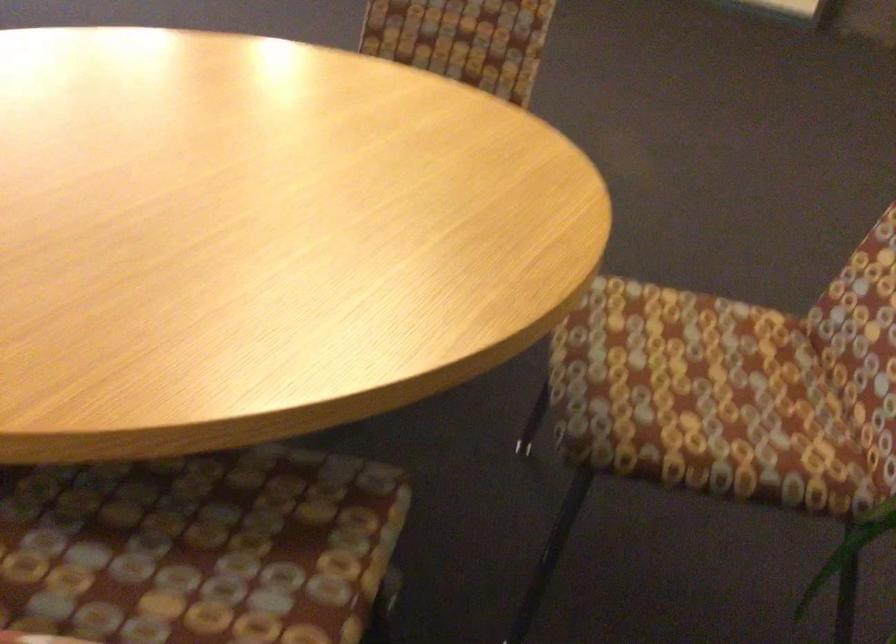
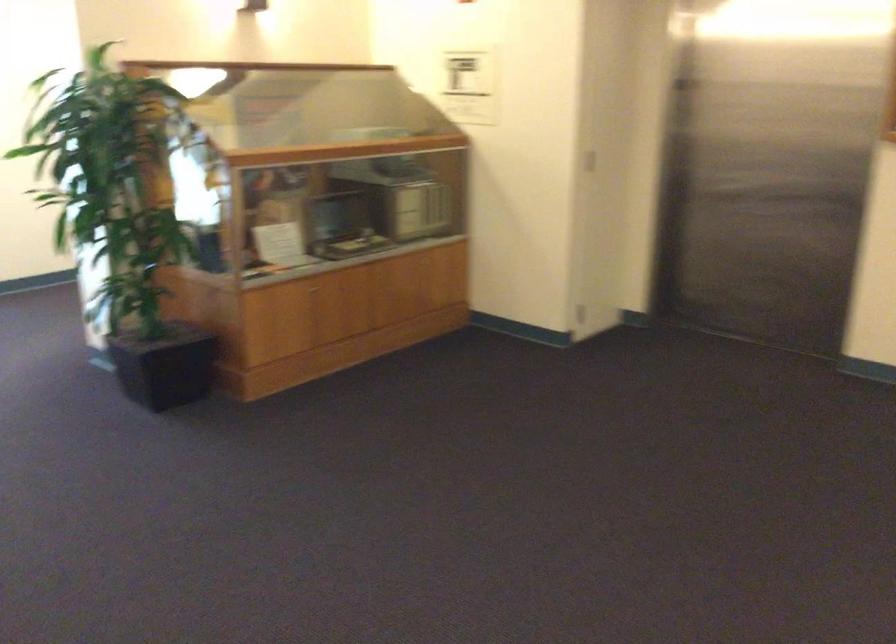
Question: What movement of the cameraman would produce the second image?

Choices:
 (A) Left
 (B) Right
 (C) Forward
 (D) Backward

Answer: (D)